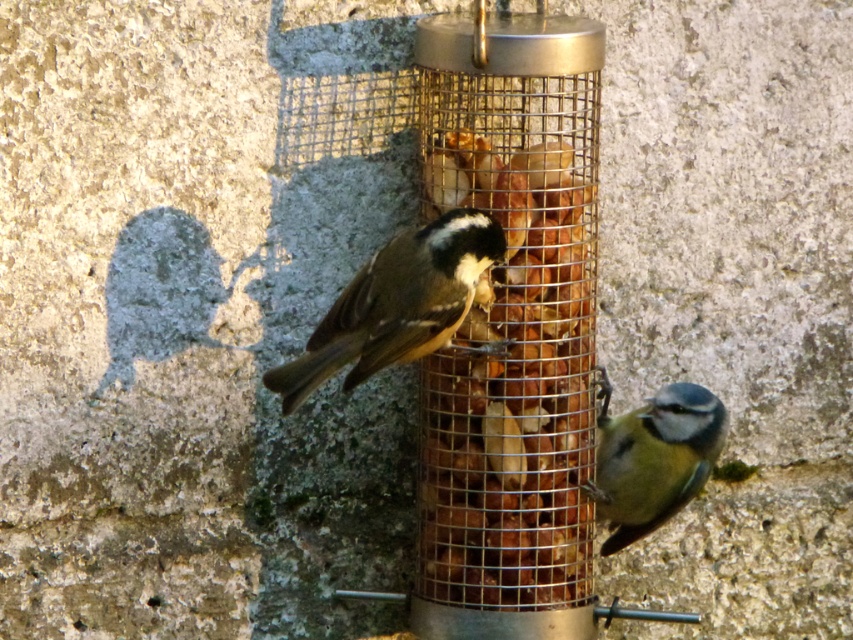
Question: Which point appears closest to the camera in this image?

Choices:
 (A) (370, 308)
 (B) (553, 406)
 (C) (663, 476)

Answer: (A)

Question: Can you confirm if brown matte bird at center is positioned above blue matte bird at lower right?

Choices:
 (A) yes
 (B) no

Answer: (A)

Question: Which object is positioned farthest from the brown matte bird at center?

Choices:
 (A) blue matte bird at lower right
 (B) brown textured nuts at center

Answer: (A)

Question: Which point is farther to the camera?

Choices:
 (A) brown matte bird at center
 (B) blue matte bird at lower right
 (C) brown textured nuts at center

Answer: (B)

Question: Can you confirm if brown textured nuts at center is positioned to the left of blue matte bird at lower right?

Choices:
 (A) no
 (B) yes

Answer: (B)

Question: Does brown textured nuts at center appear under brown matte bird at center?

Choices:
 (A) no
 (B) yes

Answer: (B)